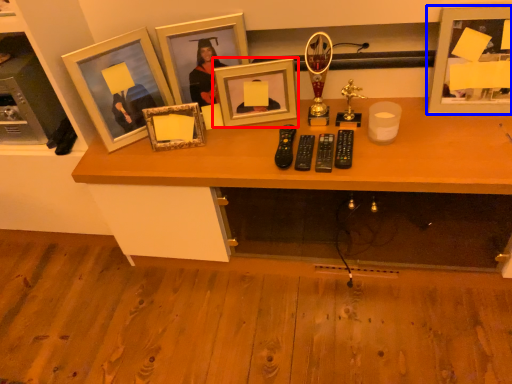
Question: Which object appears closest to the camera in this image, picture frame (highlighted by a red box) or picture frame (highlighted by a blue box)?

Choices:
 (A) picture frame
 (B) picture frame

Answer: (B)